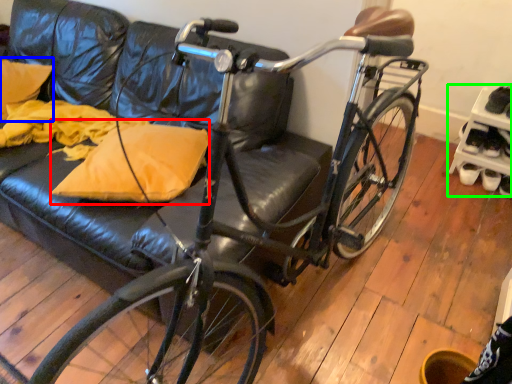
Question: Estimate the real-world distances between objects in this image. Which object is farther from throw pillow (highlighted by a red box), pillow (highlighted by a blue box) or shelf (highlighted by a green box)?

Choices:
 (A) pillow
 (B) shelf

Answer: (B)